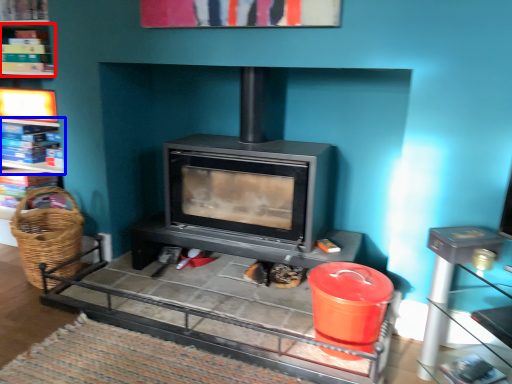
Question: Among these objects, which one is farthest to the camera, shelf (highlighted by a red box) or shelf (highlighted by a blue box)?

Choices:
 (A) shelf
 (B) shelf

Answer: (B)